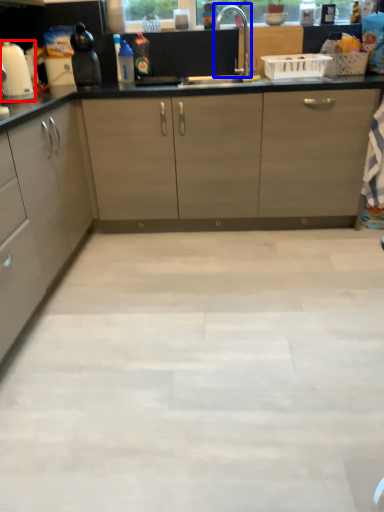
Question: Among these objects, which one is nearest to the camera, home appliance (highlighted by a red box) or faucet (highlighted by a blue box)?

Choices:
 (A) home appliance
 (B) faucet

Answer: (A)